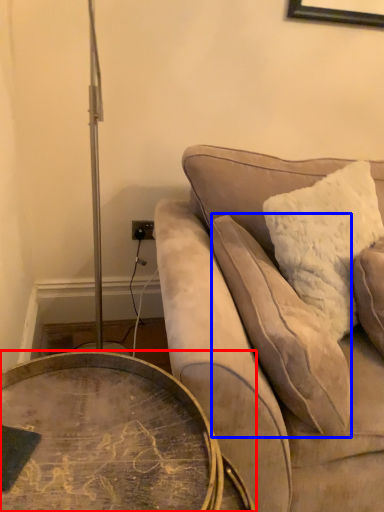
Question: Which point is closer to the camera, coffee table (highlighted by a red box) or pillow (highlighted by a blue box)?

Choices:
 (A) coffee table
 (B) pillow

Answer: (A)